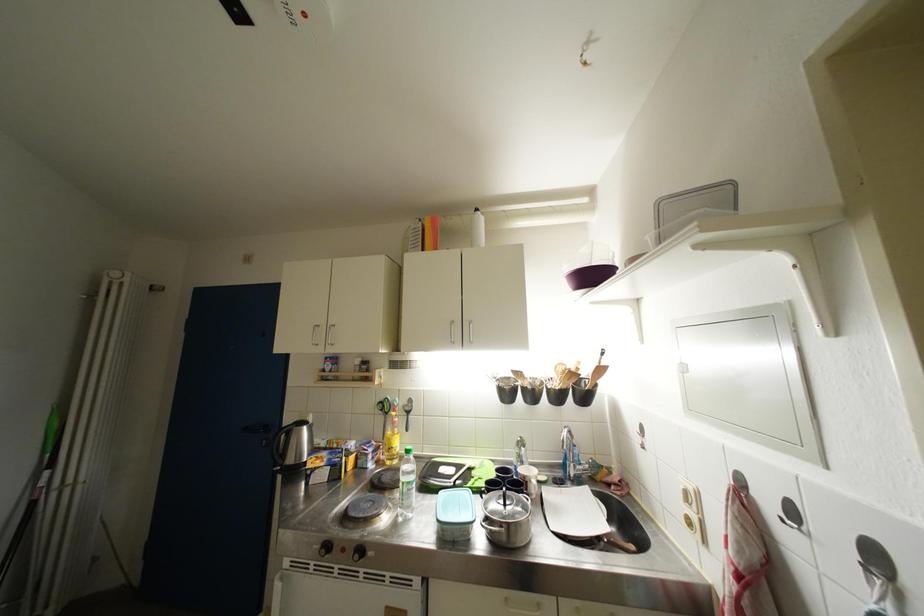
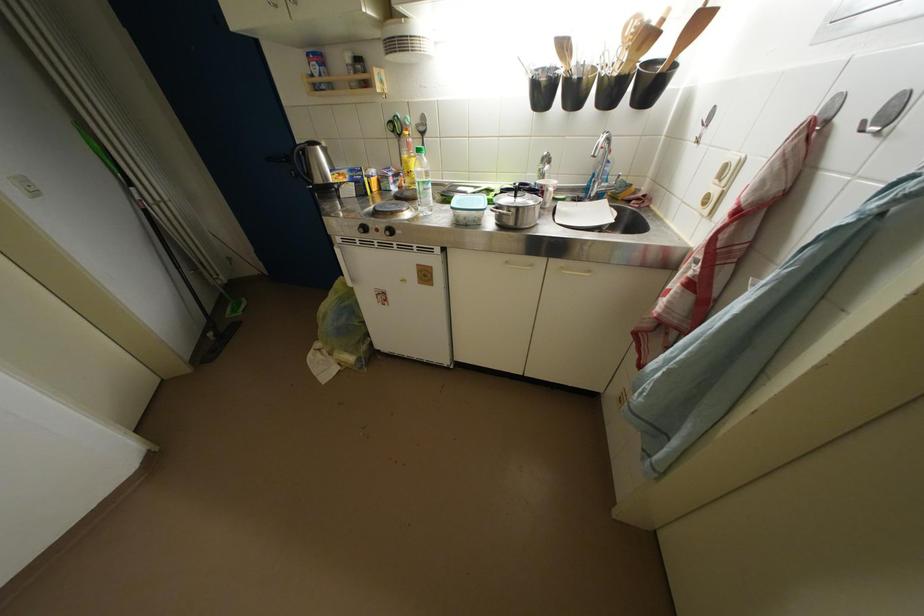
Find the pixel in the second image that matches point (311, 432) in the first image.

(324, 152)